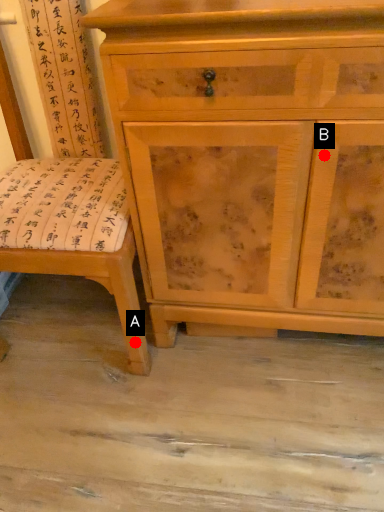
Question: Two points are circled on the image, labeled by A and B beside each circle. Which point is farther to the camera?

Choices:
 (A) A is further
 (B) B is further

Answer: (A)